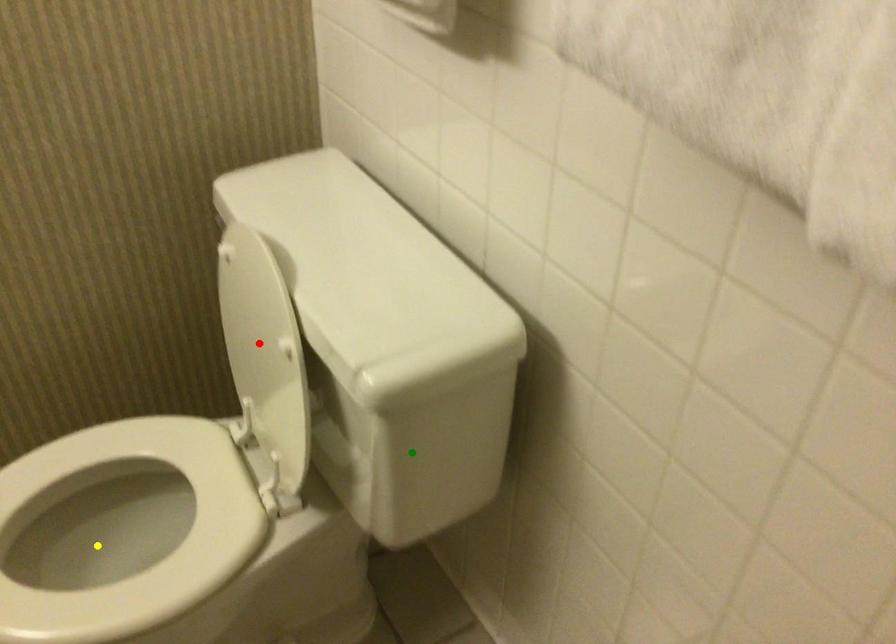
Order these from farthest to nearest:
yellow point
green point
red point

1. yellow point
2. green point
3. red point